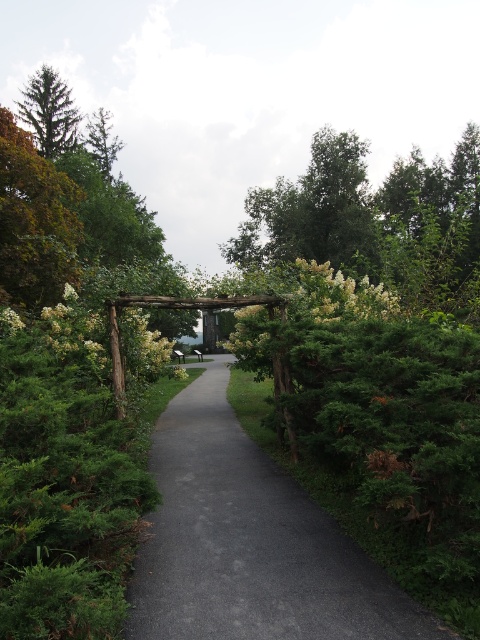
Between green leafy tree at upper center and green matte tree at upper left, which one has more height?

green leafy tree at upper center is taller.

Is point (269, 218) positioned before point (24, 198)?

No, it is not.

Identify the location of green leafy tree at upper center. The width and height of the screenshot is (480, 640). click(x=313, y=212).

Who is positioned more to the left, white fluffy flowers at center or green matte evergreen tree at upper left?

Positioned to the left is green matte evergreen tree at upper left.

Is white fluffy flowers at center closer to camera compared to green matte evergreen tree at upper left?

Yes, it is in front of green matte evergreen tree at upper left.

Is point (131, 310) positioned behind point (54, 112)?

No, (131, 310) is in front of (54, 112).

The width and height of the screenshot is (480, 640). In order to click on white fluffy flowers at center in this screenshot , I will do `click(141, 346)`.

Which is behind, point (1, 237) or point (61, 100)?

Positioned behind is point (61, 100).

Is point (16, 230) farther from camera compared to point (26, 109)?

No, it is not.

Between point (6, 252) and point (71, 148), which one is positioned behind?

The point (71, 148) is behind.

Identify the location of green matte tree at upper left. Image resolution: width=480 pixels, height=640 pixels. (35, 221).